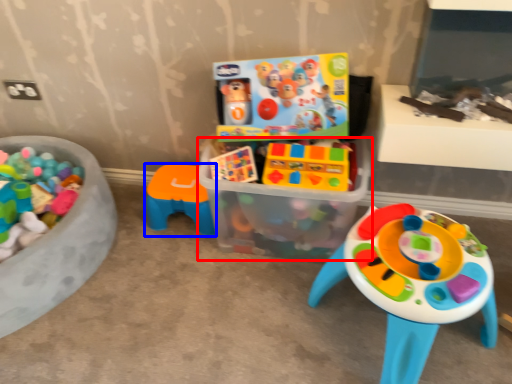
Question: Which object is closer to the camera taking this photo, box (highlighted by a red box) or toy (highlighted by a blue box)?

Choices:
 (A) box
 (B) toy

Answer: (A)